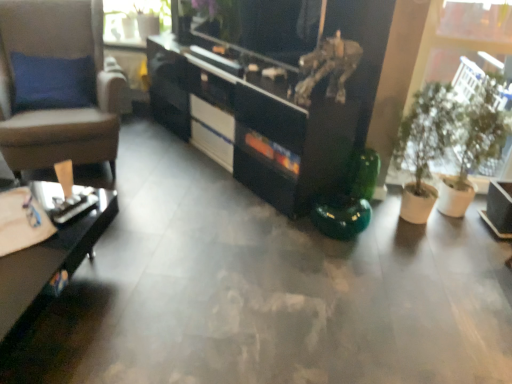
Question: Choose the correct answer: Is clear glass vase at upper left inside black glossy desk at lower left or outside it?

Choices:
 (A) outside
 (B) inside

Answer: (A)

Question: Considering the relative positions of clear glass vase at upper left and black glossy desk at lower left in the image provided, is clear glass vase at upper left to the left or to the right of black glossy desk at lower left?

Choices:
 (A) left
 (B) right

Answer: (B)

Question: Estimate the real-world distances between objects in this image. Which object is farther from the white glossy drawer at center?

Choices:
 (A) black glossy cabinet at center
 (B) black glossy desk at lower left
 (C) brown leather chair at left
 (D) green matte plant at right
 (E) clear glass vase at upper left

Answer: (D)

Question: Considering the real-world distances, which object is closest to the black glossy desk at lower left?

Choices:
 (A) black glossy cabinet at center
 (B) green matte plant at right
 (C) white glossy drawer at center
 (D) clear glass vase at upper left
 (E) brown leather chair at left

Answer: (E)